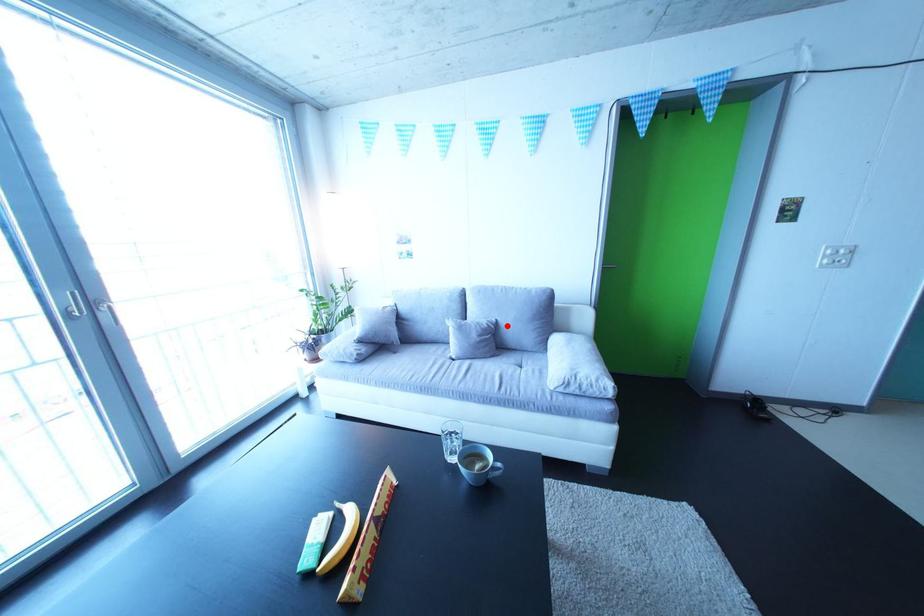
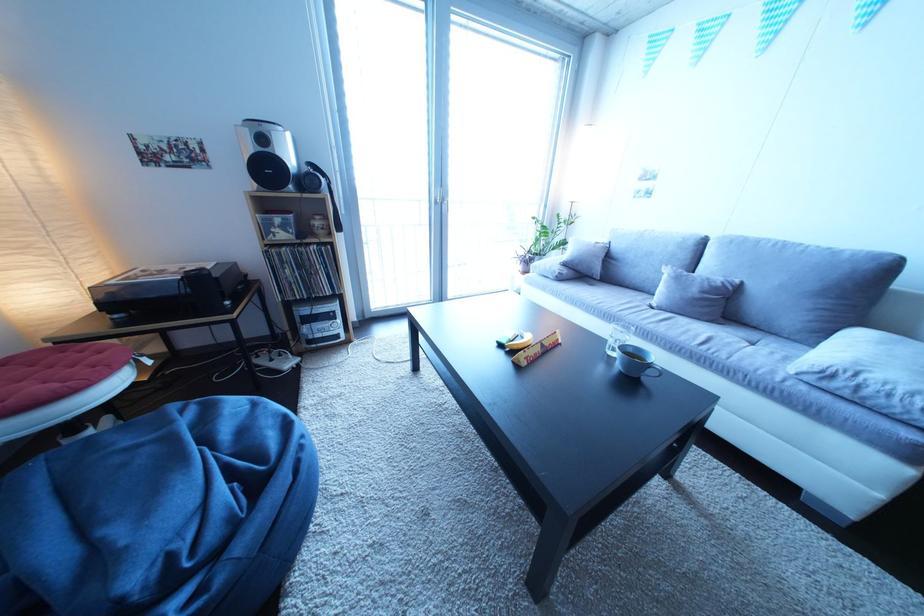
Locate, in the second image, the point that corresponds to the highlighted location in the first image.

(750, 286)